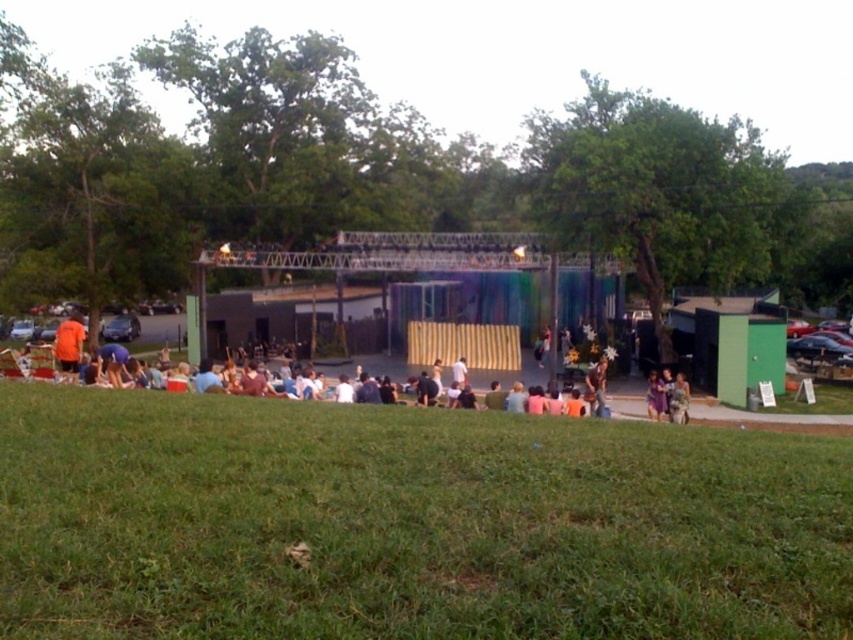
Which is behind, point (770, 362) or point (660, 419)?

The point (770, 362) is behind.

Does green matte tent at lower right lie in front of light brown fabric dress at center?

That is False.

Who is more distant from viewer, (708, 364) or (660, 387)?

Point (708, 364)

This screenshot has height=640, width=853. What are the coordinates of `green matte tent at lower right` in the screenshot? It's located at (730, 342).

Which is above, wooden stage at center or green matte tent at lower right?

Positioned higher is wooden stage at center.

Find the location of `wooden stage at center`. wooden stage at center is located at coordinates (396, 266).

Where is `wooden stage at center`? The height and width of the screenshot is (640, 853). wooden stage at center is located at coordinates (396, 266).

Who is higher up, orange fabric shirt at lower left or light brown fabric dress at center?

Positioned higher is orange fabric shirt at lower left.

Who is more distant from viewer, [80,337] or [648,417]?

Positioned behind is point [648,417].

Find the location of a particular element. The height and width of the screenshot is (640, 853). orange fabric shirt at lower left is located at coordinates (68, 342).